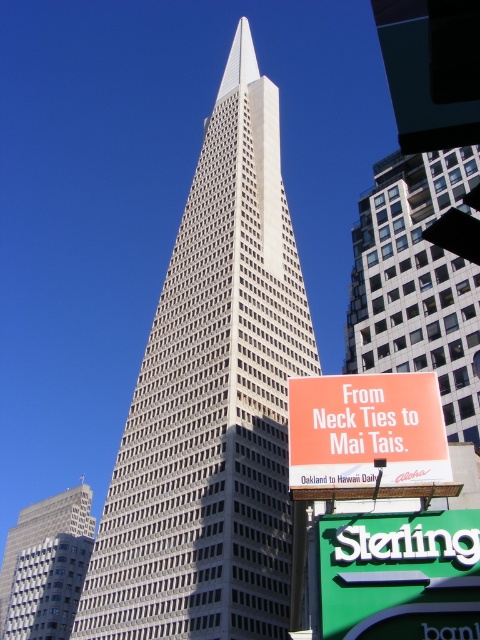
Can you confirm if white concrete skyscraper at upper center is smaller than gray concrete skyscraper at center?

Yes.

Can you confirm if white concrete skyscraper at upper center is positioned above gray concrete skyscraper at center?

Correct, white concrete skyscraper at upper center is located above gray concrete skyscraper at center.

Where is `white concrete skyscraper at upper center`? The height and width of the screenshot is (640, 480). white concrete skyscraper at upper center is located at coordinates (417, 282).

The image size is (480, 640). I want to click on white concrete skyscraper at upper center, so click(417, 282).

In the scene shown: Is white concrete skyscraper at upper center shorter than green plastic sign at lower right?

No, white concrete skyscraper at upper center is not shorter than green plastic sign at lower right.

Between white concrete skyscraper at upper center and green plastic sign at lower right, which one is positioned lower?

green plastic sign at lower right

You are a GUI agent. You are given a task and a screenshot of the screen. Output one action in this format:
    pyautogui.click(x=<x>, y=<y>)
    Task: Click on the white concrete skyscraper at upper center
    
    Given the screenshot: What is the action you would take?
    pyautogui.click(x=417, y=282)

Is green plastic sign at lower right shorter than orange matte sign at center?

Yes.

Is point (396, 529) farther from camera compared to point (400, 467)?

No, it is not.

Find the location of a particular element. The width and height of the screenshot is (480, 640). green plastic sign at lower right is located at coordinates (399, 576).